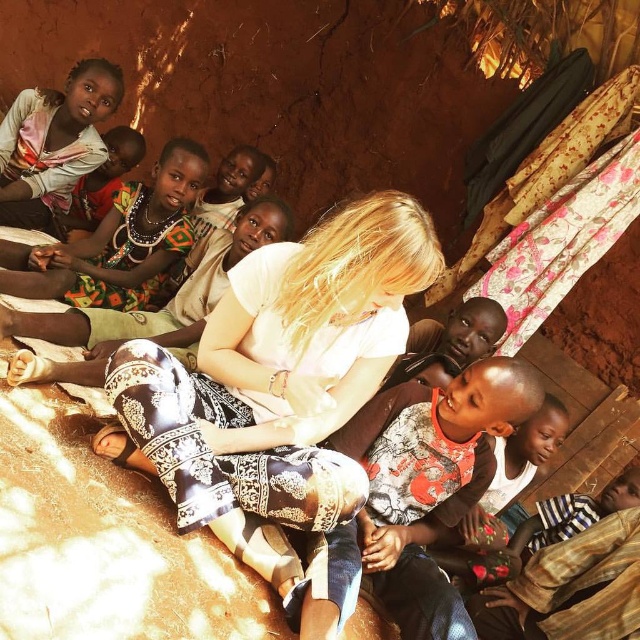
Question: Can you confirm if white printed pants at center is bigger than printed fabric dress at upper left?

Choices:
 (A) no
 (B) yes

Answer: (B)

Question: Which point appears closest to the camera in this image?

Choices:
 (A) (36, 113)
 (B) (230, 474)
 (C) (96, 339)
 (D) (189, 152)

Answer: (B)

Question: Does printed fabric dress at upper left appear on the right side of matte pink scarf at upper left?

Choices:
 (A) no
 (B) yes

Answer: (B)

Question: Which point appears farthest from the camera in this image?

Choices:
 (A) (64, 333)
 (B) (410, 227)

Answer: (A)

Question: Which of the following is the closest to the observer?

Choices:
 (A) (314, 401)
 (B) (148, 321)
 (C) (51, 112)

Answer: (A)

Question: From the image, what is the correct spatial relationship of white printed pants at center in relation to matte pink scarf at upper left?

Choices:
 (A) below
 (B) above

Answer: (A)